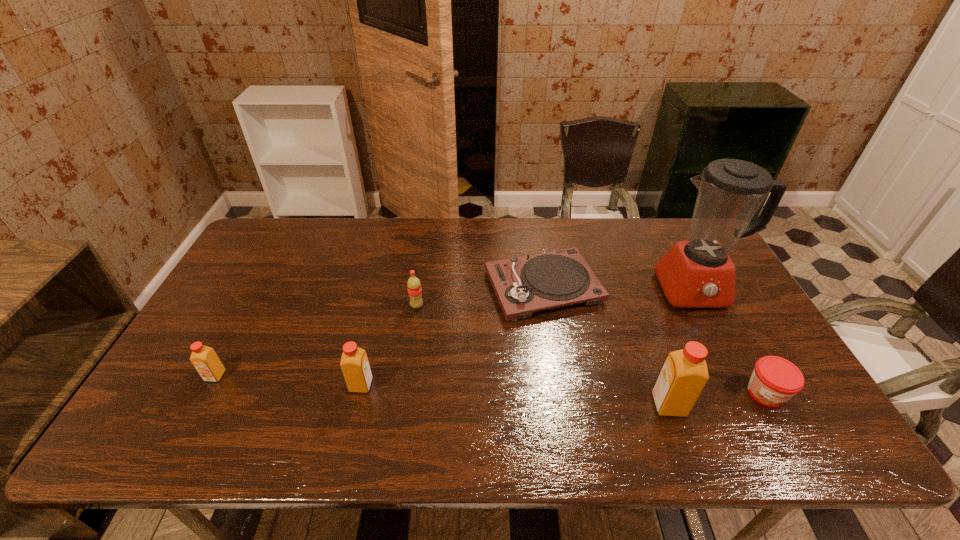
Where is `vacant space in between the jam and the fifth object from left to right`? This screenshot has width=960, height=540. vacant space in between the jam and the fifth object from left to right is located at coordinates (717, 399).

Select which object is the fifth closest to the second shortest orange juice. Please provide its 2D coordinates. Your answer should be formatted as a tuple, i.e. [(x, y)], where the tuple contains the x and y coordinates of a point satisfying the conditions above.

[(698, 273)]

Identify the location of the closest object to the rightmost orange juice. (775, 380).

Identify which orange juice is located as the second nearest to the blender. Please provide its 2D coordinates. Your answer should be formatted as a tuple, i.e. [(x, y)], where the tuple contains the x and y coordinates of a point satisfying the conditions above.

[(354, 363)]

Identify the location of orange juice that is the closest to the jam. The image size is (960, 540). (684, 375).

This screenshot has width=960, height=540. Identify the location of vacant space that satisfies the following two spatial constraints: 1. on the front of the tallest object near the controls; 2. on the front and back of the sixth shortest object. (752, 405).